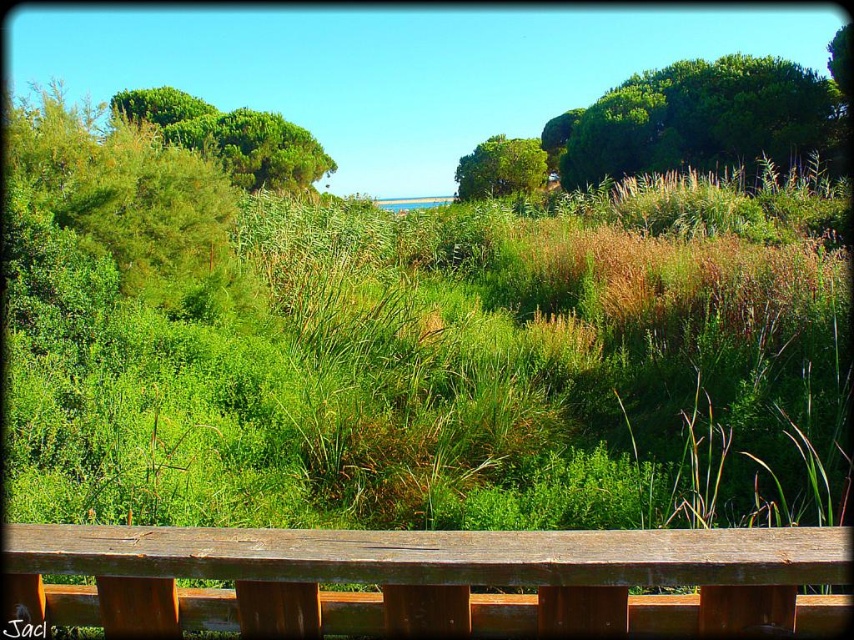
Is green leafy tree at upper right thinner than green leafy tree at center?

In fact, green leafy tree at upper right might be wider than green leafy tree at center.

Consider the image. Is green leafy tree at upper right positioned in front of green leafy tree at center?

Yes, it is.

The image size is (854, 640). What do you see at coordinates (700, 120) in the screenshot?
I see `green leafy tree at upper right` at bounding box center [700, 120].

Locate an element on the screen. The height and width of the screenshot is (640, 854). green leafy tree at upper right is located at coordinates (700, 120).

Does weathered wood picnic table at center appear on the left side of green leafy tree at upper left?

No, weathered wood picnic table at center is not to the left of green leafy tree at upper left.

Between point (595, 547) and point (314, 163), which one is positioned in front?

Point (595, 547) is more forward.

Describe the element at coordinates (427, 580) in the screenshot. This screenshot has height=640, width=854. I see `weathered wood picnic table at center` at that location.

Identify the location of weathered wood picnic table at center. (427, 580).

Which is more to the right, weathered wood picnic table at center or green leafy tree at upper right?

From the viewer's perspective, green leafy tree at upper right appears more on the right side.

Between weathered wood picnic table at center and green leafy tree at upper right, which one has more height?

With more height is green leafy tree at upper right.

The height and width of the screenshot is (640, 854). What do you see at coordinates (427, 580) in the screenshot?
I see `weathered wood picnic table at center` at bounding box center [427, 580].

The width and height of the screenshot is (854, 640). Identify the location of weathered wood picnic table at center. (427, 580).